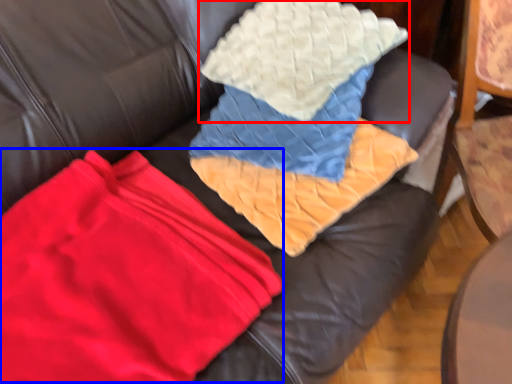
Question: Which point is further to the camera, throw pillow (highlighted by a red box) or fabric (highlighted by a blue box)?

Choices:
 (A) throw pillow
 (B) fabric

Answer: (A)